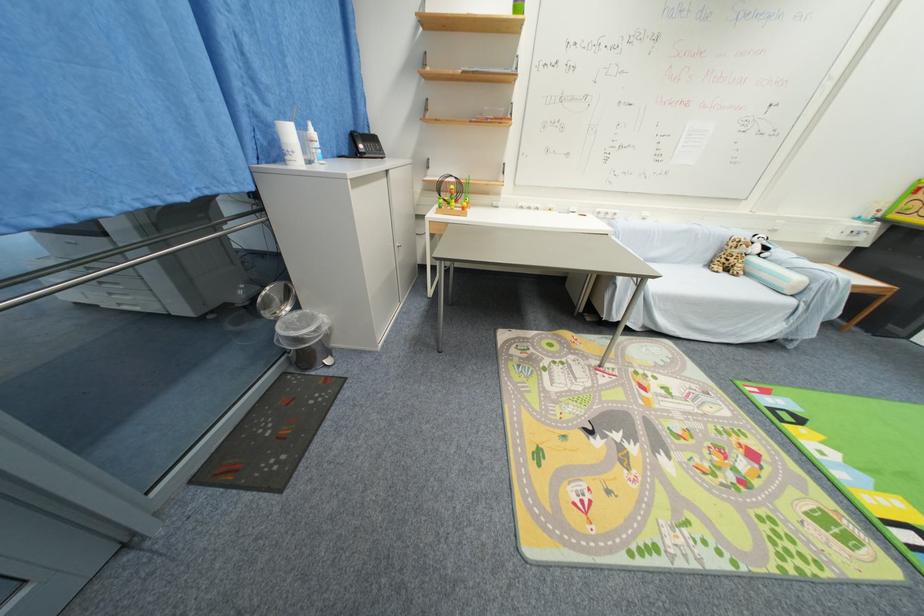
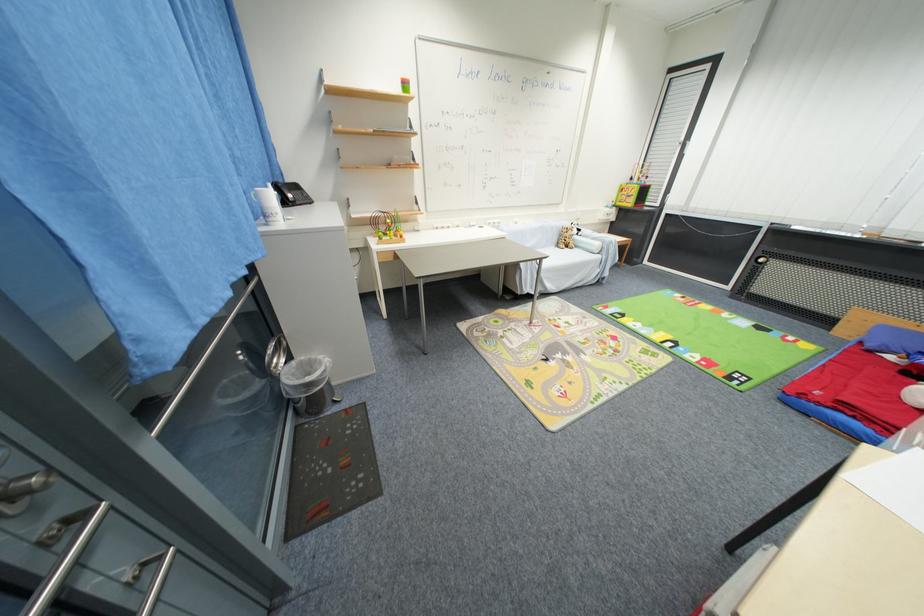
Locate, in the second image, the point that corresponds to the point at 293,160 in the first image.

(275, 222)